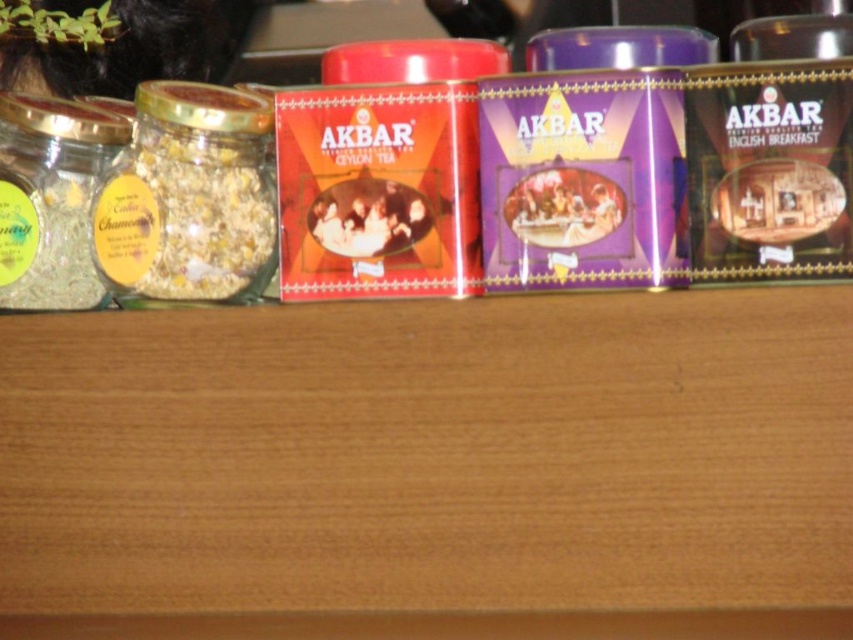
You are arranging items on a shelf and need to place the translucent glass jar at left and the clear glass jar at left. Since they are both at the left, how can you tell them apart?

The translucent glass jar at left is positioned over clear glass jar at left, so the one above is translucent while the one below is clear.

You are organizing the tea products on the wooden surface. You need to place a new box of tea between the translucent glass jar at left and the clear glass jar at left. Which jar should you move to make space?

The translucent glass jar at left might be wider than the clear glass jar at left, so moving the wider translucent glass jar at left would create more space for placing the new tea box between them.